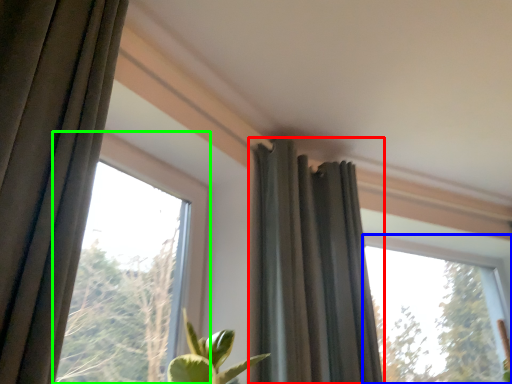
Question: Considering the real-world distances, which object is farthest from curtain (highlighted by a red box)? window (highlighted by a blue box) or window (highlighted by a green box)?

Choices:
 (A) window
 (B) window

Answer: (A)